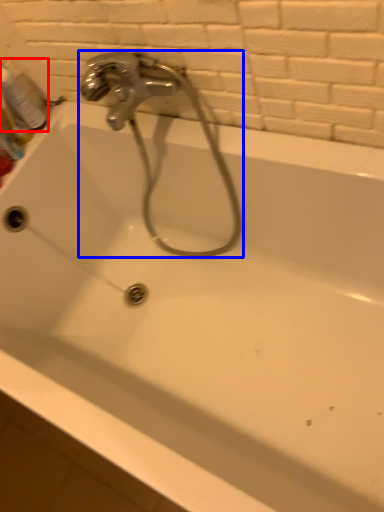
Question: Which point is further to the camera, mouthwash (highlighted by a red box) or plumbing fixture (highlighted by a blue box)?

Choices:
 (A) mouthwash
 (B) plumbing fixture

Answer: (A)